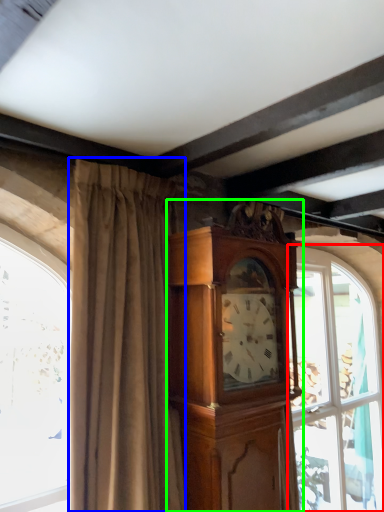
Question: Considering the real-world distances, which object is closest to window (highlighted by a red box)? curtain (highlighted by a blue box) or cabinetry (highlighted by a green box).

Choices:
 (A) curtain
 (B) cabinetry

Answer: (B)